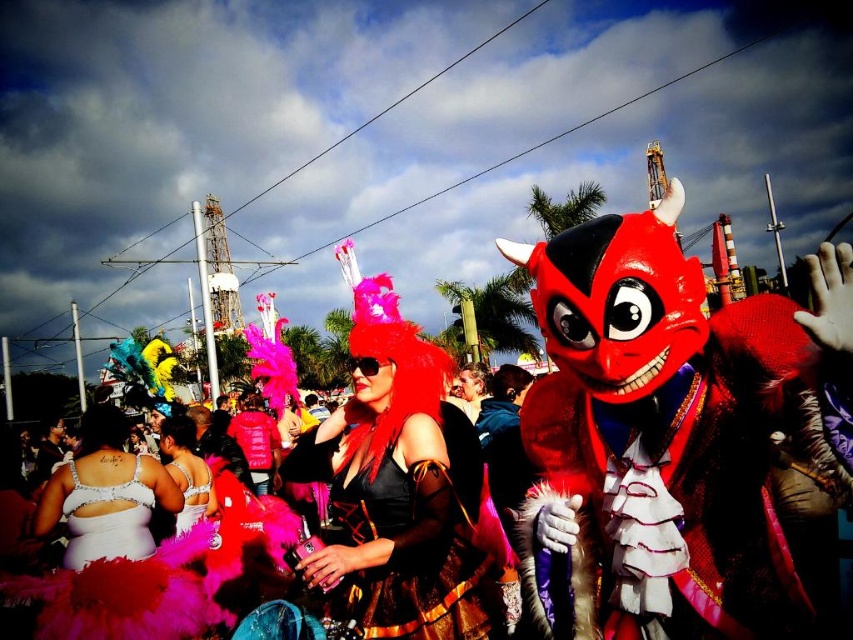
You are a photographer at the event and want to capture both the shiny red devil mask at center and the shiny silver dress at lower left in the same frame. Which object should you focus on first to ensure both are in focus?

The shiny red devil mask at center is bigger than the shiny silver dress at lower left, so you should focus on the shiny red devil mask at center first to ensure both are in focus.

Based on the photo, you are a fashion designer observing the festive costumes in the image. You notice the white sequined bra at center and the shiny silver sequins at center. Which of these two items is larger in size?

The white sequined bra at center is bigger than the shiny silver sequins at center.

You are a photographer at the event and want to capture a closeup shot of both the shiny red devil mask at center and the shiny silver dress at lower left. Given their sizes, which object should you zoom in more on to ensure both are clearly visible in the frame?

The shiny red devil mask at center has a larger width than the shiny silver dress at lower left, so you should zoom in more on the shiny silver dress at lower left to ensure both are clearly visible in the frame.